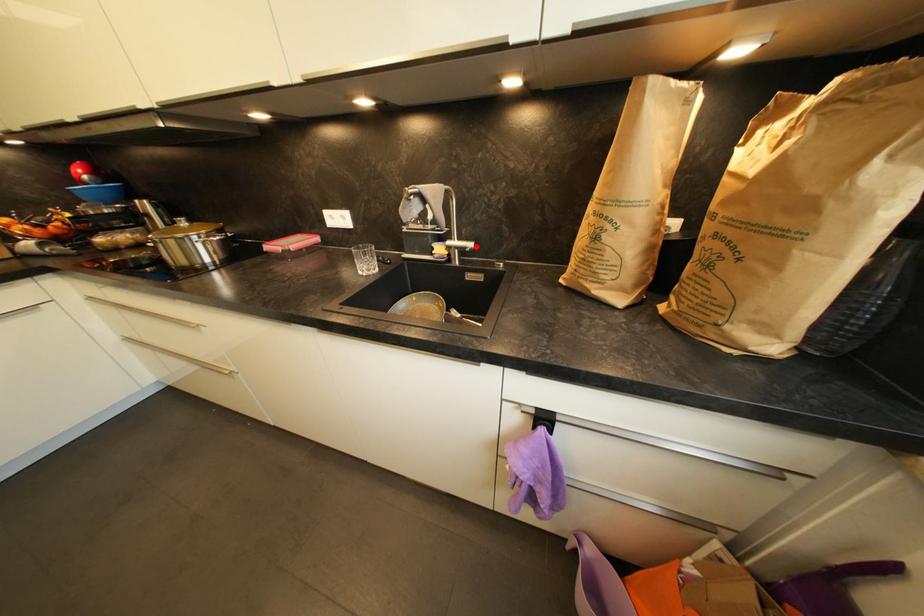
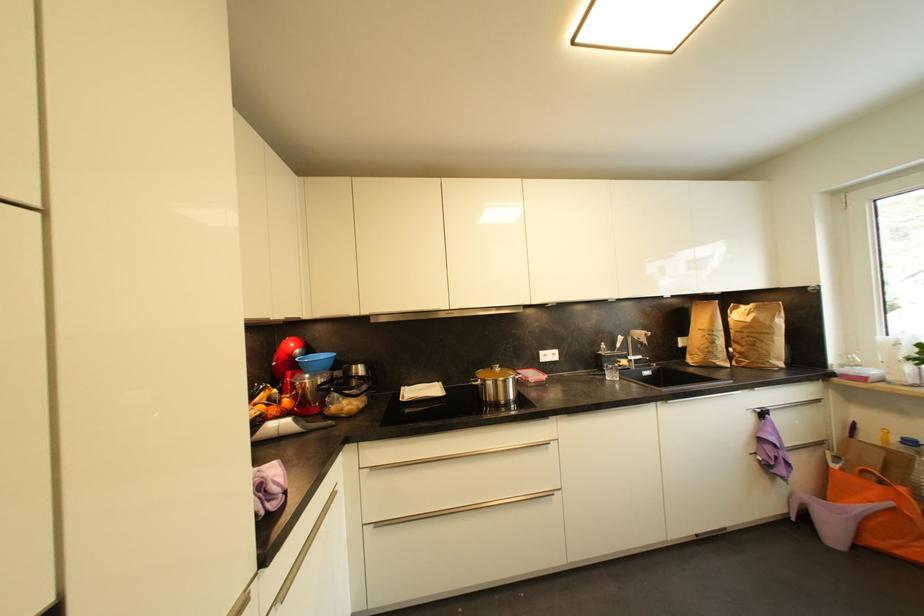
Where in the second image is the point corresponding to the highlighted location from the first image?

(645, 359)